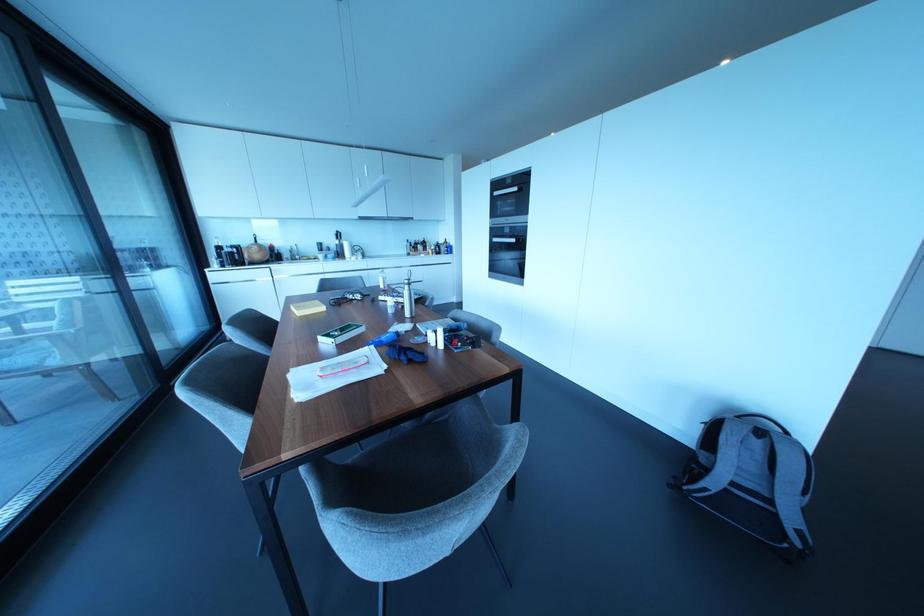
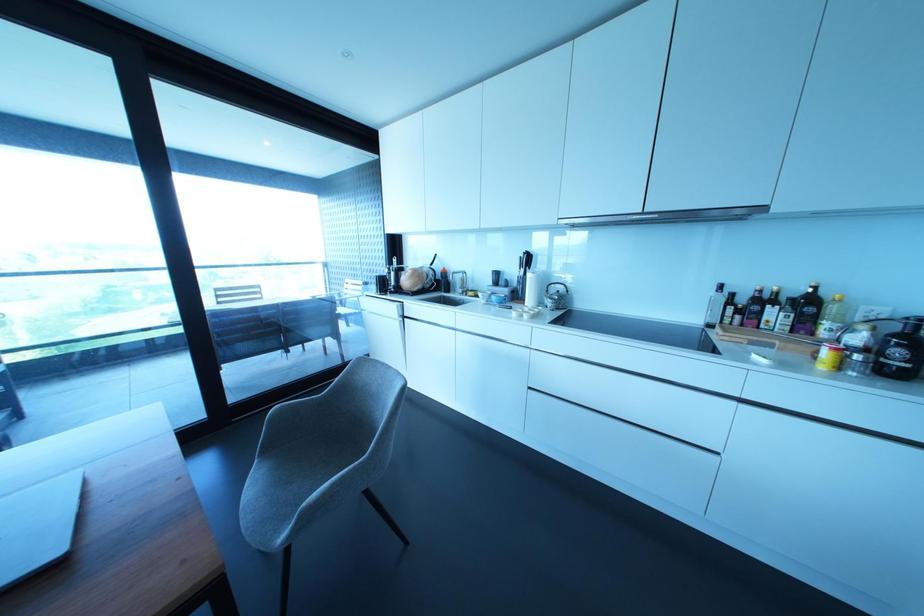
In the second image, find the point that corresponds to [337,235] in the first image.

(527, 259)